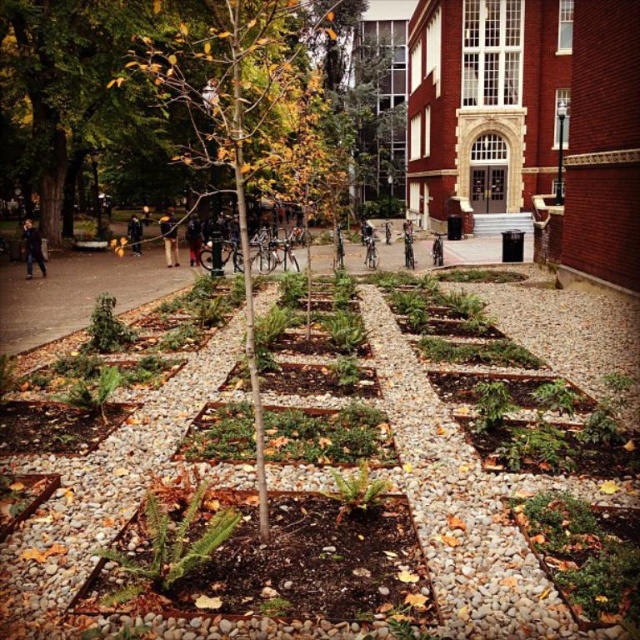
You are a gardener who needs to prune the green leafy tree at center and the dark gray jacket at center. Which object should you tackle first based on their height?

The green leafy tree at center is much taller than the dark gray jacket at center, so you should prune the green leafy tree at center first since it requires more attention due to its height.

You are a gardener in the urban garden and need to place a new black leather jacket at center. Where should you place it relative to the green leafy tree at center?

The green leafy tree at center is positioned on the right side of the black leather jacket at center, so you should place the black leather jacket at center to the left of the green leafy tree at center.

You are a gardener working in the urban garden and you need to place a black leather jacket at center. However, there is already a green leafy tree at center. Can you place the jacket directly under the tree without moving the tree?

The green leafy tree at center is located above the black leather jacket at center, so yes, you can place the jacket directly under the tree without moving it since the tree is already positioned above the jacket.